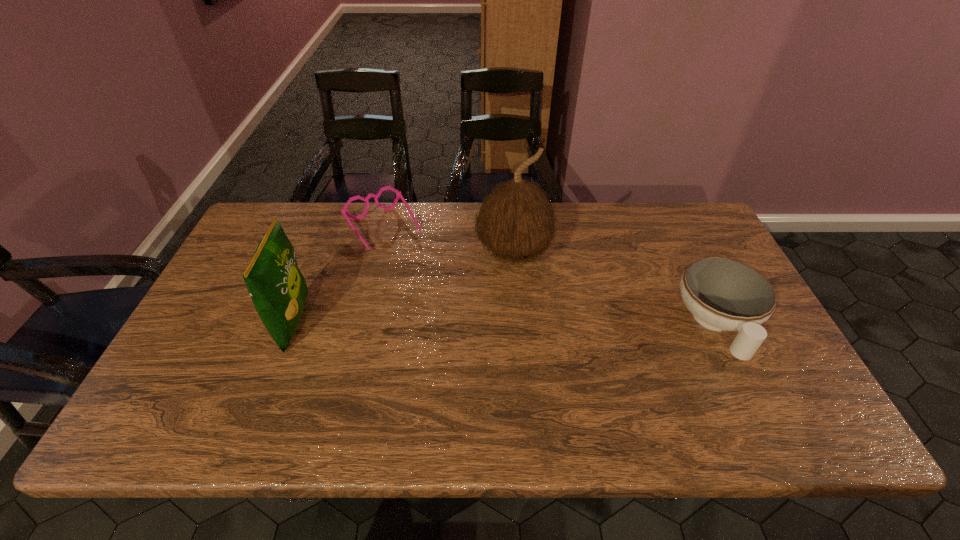
Find the location of a particular element. crisp (potato chip) is located at coordinates (278, 290).

You are a GUI agent. You are given a task and a screenshot of the screen. Output one action in this format:
    pyautogui.click(x=<x>, y=<y>)
    Task: Click on the rightmost object
    The height and width of the screenshot is (540, 960).
    Given the screenshot: What is the action you would take?
    pyautogui.click(x=722, y=294)

Where is `chinaware`? This screenshot has width=960, height=540. chinaware is located at coordinates (722, 294).

In order to click on the tallest object in this screenshot , I will do (515, 222).

I want to click on the second object from right to left, so click(x=515, y=222).

Image resolution: width=960 pixels, height=540 pixels. In order to click on spectacles in this screenshot , I will do `click(344, 212)`.

Locate an element on the screen. The width and height of the screenshot is (960, 540). free point located 0.220m on the front-facing side of the crisp (potato chip) is located at coordinates (394, 323).

This screenshot has width=960, height=540. Find the location of `free space located 0.070m on the side with the handle of the second shortest object`. free space located 0.070m on the side with the handle of the second shortest object is located at coordinates (752, 396).

The height and width of the screenshot is (540, 960). Find the location of `vacant space located on the surface of the tallest object`. vacant space located on the surface of the tallest object is located at coordinates (599, 397).

This screenshot has height=540, width=960. In order to click on free space located on the surface of the tallest object in this screenshot , I will do `click(555, 323)`.